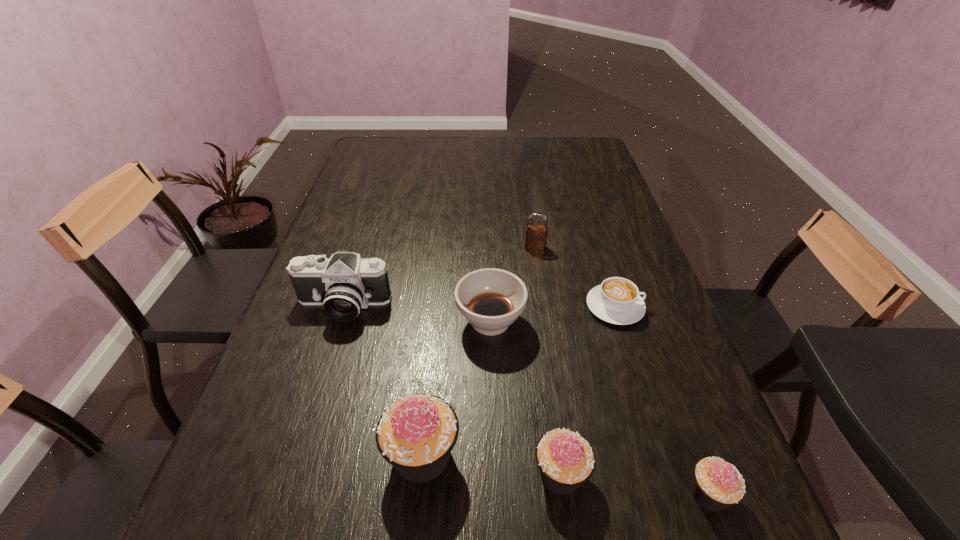
Image resolution: width=960 pixels, height=540 pixels. In the image, there is a desktop. In order to click on vacant area at the left edge in this screenshot , I will do `click(339, 245)`.

This screenshot has width=960, height=540. Find the location of `free space at the right edge of the desktop`. free space at the right edge of the desktop is located at coordinates (593, 245).

Image resolution: width=960 pixels, height=540 pixels. What are the coordinates of `free space at the near left corner of the desktop` in the screenshot? It's located at (283, 467).

Identify the location of blank region between the second cupcake from right to left and the camera. The height and width of the screenshot is (540, 960). (451, 390).

This screenshot has height=540, width=960. What are the coordinates of `free space that is in between the second tallest cupcake and the cappuccino` in the screenshot? It's located at (588, 390).

At what (x,y) coordinates should I click in order to perform the action: click on free point between the cappuccino and the second tallest cupcake. Please return your answer as a coordinate pair (x, y). Image resolution: width=960 pixels, height=540 pixels. Looking at the image, I should click on (588, 390).

Where is `vacant region between the second cupcake from left to right and the leftmost object`? vacant region between the second cupcake from left to right and the leftmost object is located at coordinates (451, 390).

Where is `blank region between the second shortest cupcake and the leftmost object`? blank region between the second shortest cupcake and the leftmost object is located at coordinates (451, 390).

Where is `vacant region between the camera and the shortest cupcake`? This screenshot has width=960, height=540. vacant region between the camera and the shortest cupcake is located at coordinates (525, 400).

Locate an element on the screen. The height and width of the screenshot is (540, 960). vacant space that's between the leftmost cupcake and the cappuccino is located at coordinates (518, 381).